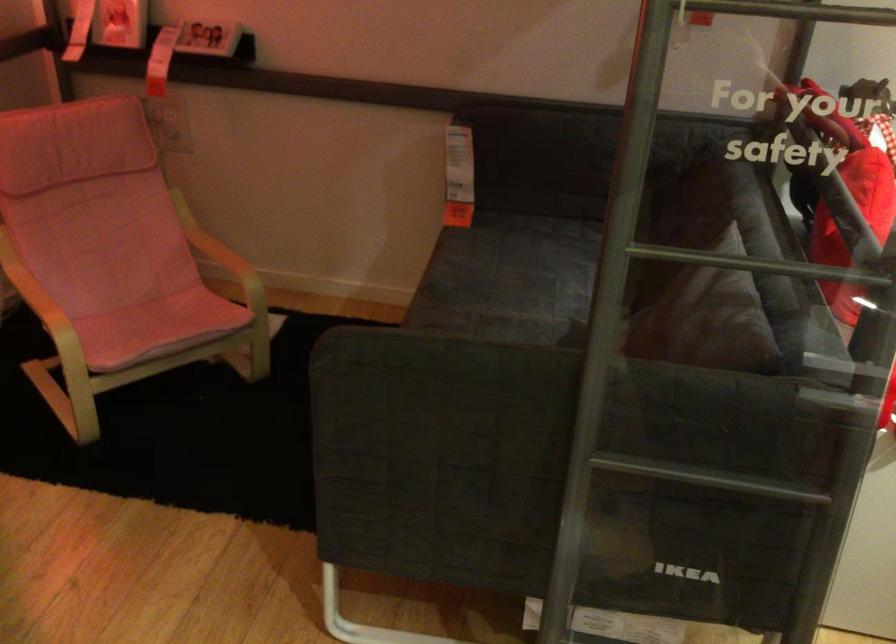
Find the location of `wooden chair armrest`. wooden chair armrest is located at coordinates (220, 252).